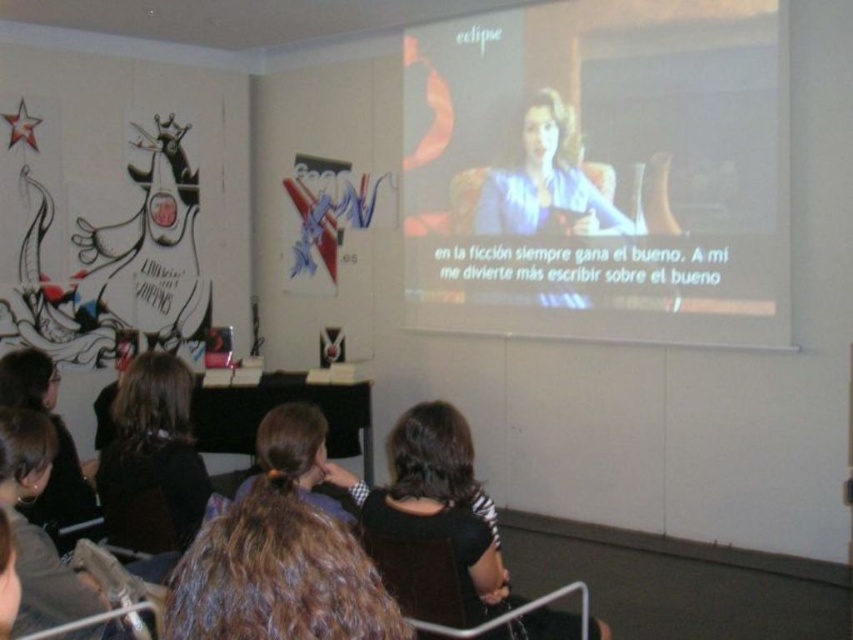
In the scene shown: You are an artist attending a lecture and notice two people in the audience with brown hair. The first has brown hair at center and the second has dark brown hair at lower left. Which person has hair with a smaller width?

The brown hair at center has a smaller width than the dark brown hair at lower left.